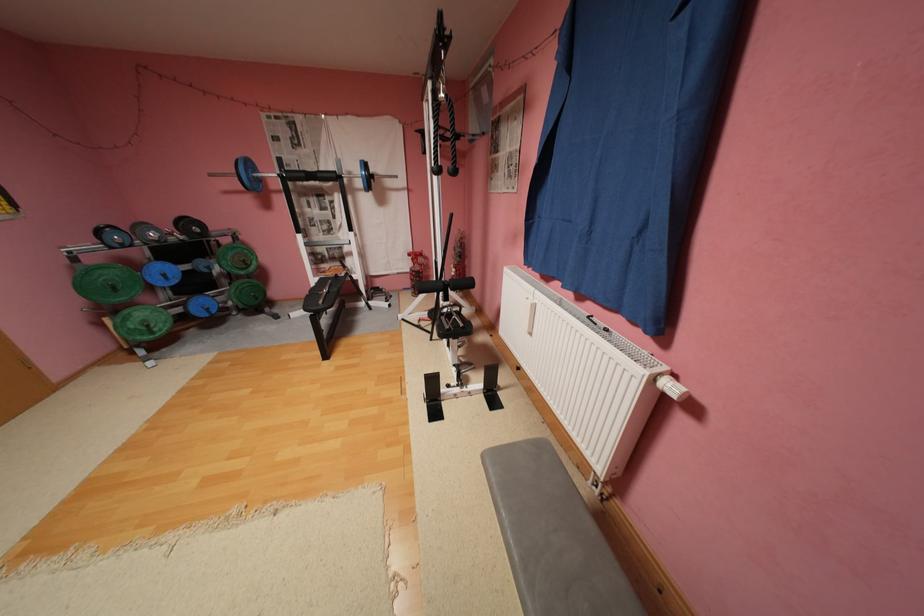
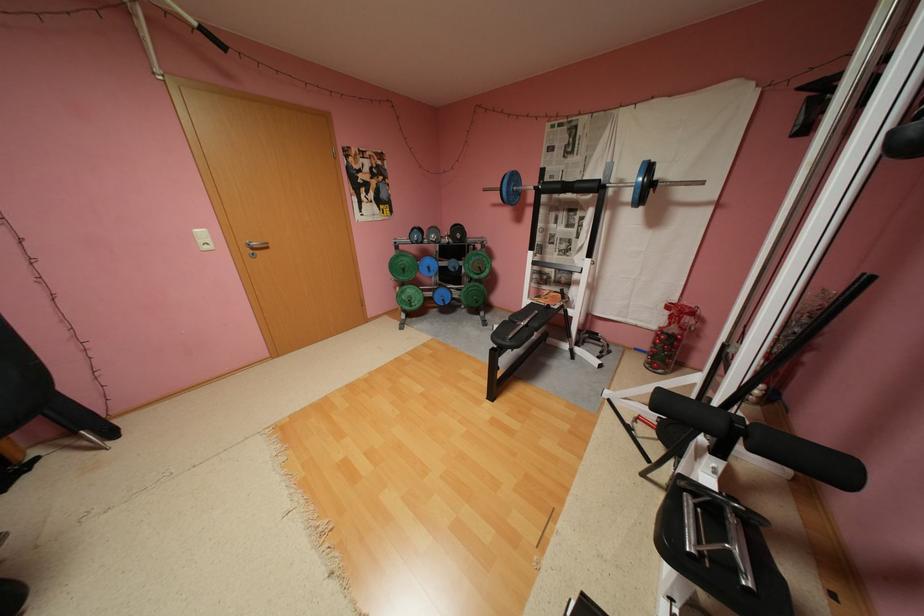
Where in the second image is the point corresponding to point 238,314 from the first image?

(468, 306)